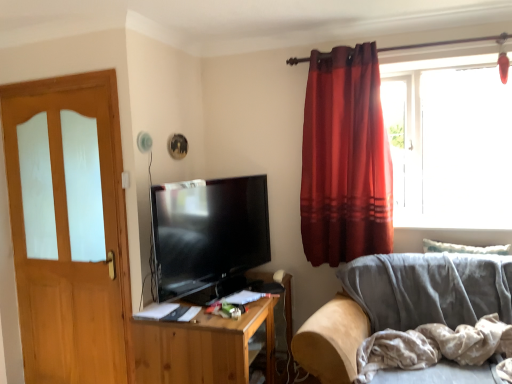
Question: Is light brown wood door at left facing towards matte black tv at center?

Choices:
 (A) no
 (B) yes

Answer: (A)

Question: Considering the relative positions of light brown wood door at left and matte black tv at center in the image provided, is light brown wood door at left behind matte black tv at center?

Choices:
 (A) no
 (B) yes

Answer: (B)

Question: Can you confirm if light brown wood door at left is shorter than matte black tv at center?

Choices:
 (A) no
 (B) yes

Answer: (A)

Question: Is light brown wood door at left next to matte black tv at center?

Choices:
 (A) no
 (B) yes

Answer: (A)

Question: Is light brown wood door at left wider than matte black tv at center?

Choices:
 (A) no
 (B) yes

Answer: (A)

Question: Does light brown wood door at left have a smaller size compared to matte black tv at center?

Choices:
 (A) no
 (B) yes

Answer: (B)

Question: From a real-world perspective, is matte black tv at center on transparent glass window at upper right?

Choices:
 (A) no
 (B) yes

Answer: (A)

Question: Can we say matte black tv at center lies outside transparent glass window at upper right?

Choices:
 (A) yes
 (B) no

Answer: (A)

Question: Considering the relative sizes of matte black tv at center and transparent glass window at upper right in the image provided, is matte black tv at center taller than transparent glass window at upper right?

Choices:
 (A) yes
 (B) no

Answer: (B)

Question: Considering the relative sizes of matte black tv at center and transparent glass window at upper right in the image provided, is matte black tv at center thinner than transparent glass window at upper right?

Choices:
 (A) no
 (B) yes

Answer: (B)

Question: Considering the relative sizes of matte black tv at center and transparent glass window at upper right in the image provided, is matte black tv at center smaller than transparent glass window at upper right?

Choices:
 (A) no
 (B) yes

Answer: (B)

Question: Is matte black tv at center further to the viewer compared to transparent glass window at upper right?

Choices:
 (A) yes
 (B) no

Answer: (B)

Question: Is light brown wood door at left oriented away from velvet gray couch at lower right?

Choices:
 (A) no
 (B) yes

Answer: (A)